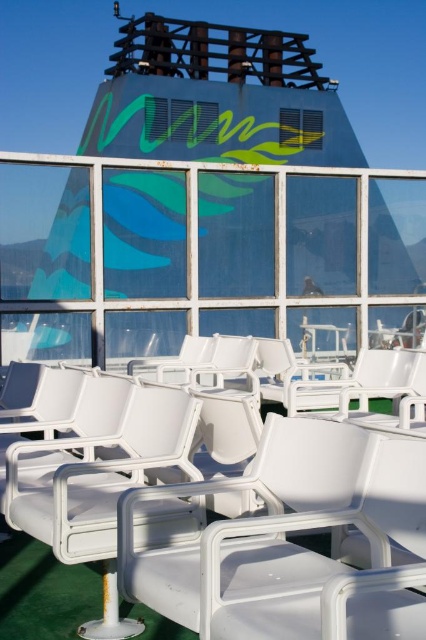
Who is shorter, white plastic chairs at center or white plastic chair at center?

With less height is white plastic chair at center.

Does white plastic chairs at center have a greater width compared to white plastic chair at center?

Indeed, white plastic chairs at center has a greater width compared to white plastic chair at center.

At what (x,y) coordinates should I click in order to perform the action: click on white plastic chairs at center. Please return your answer as a coordinate pair (x, y). The height and width of the screenshot is (640, 426). Looking at the image, I should click on (203, 205).